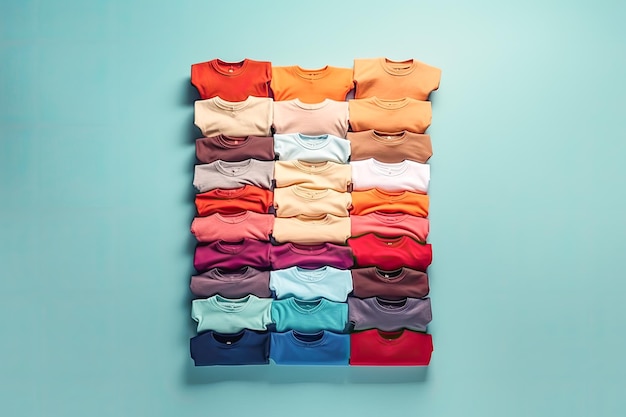
The height and width of the screenshot is (417, 626). Find the location of `folded shirts on the rightmost column`. folded shirts on the rightmost column is located at coordinates (392, 75), (394, 105), (392, 150), (393, 174), (394, 200), (394, 219), (396, 246), (397, 275), (397, 309), (399, 344).